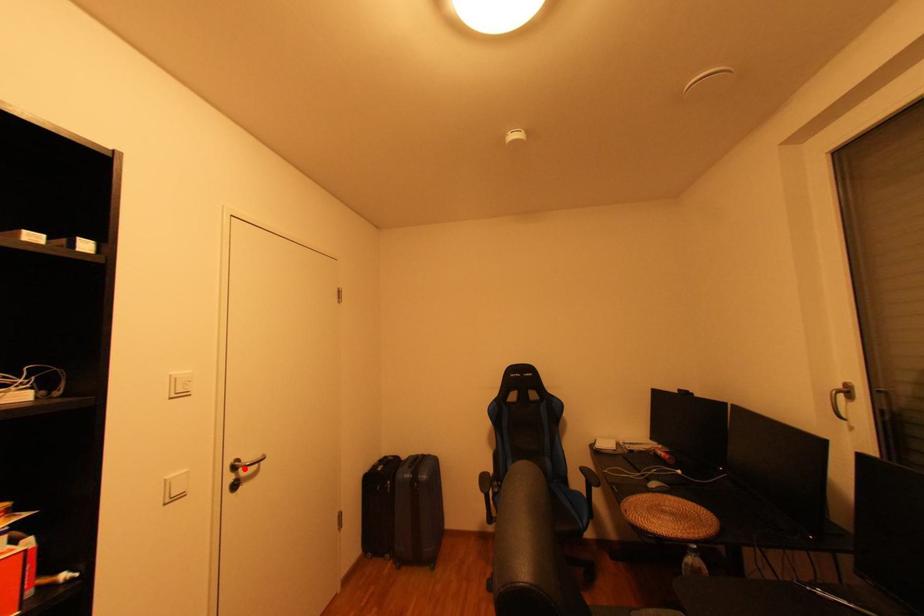
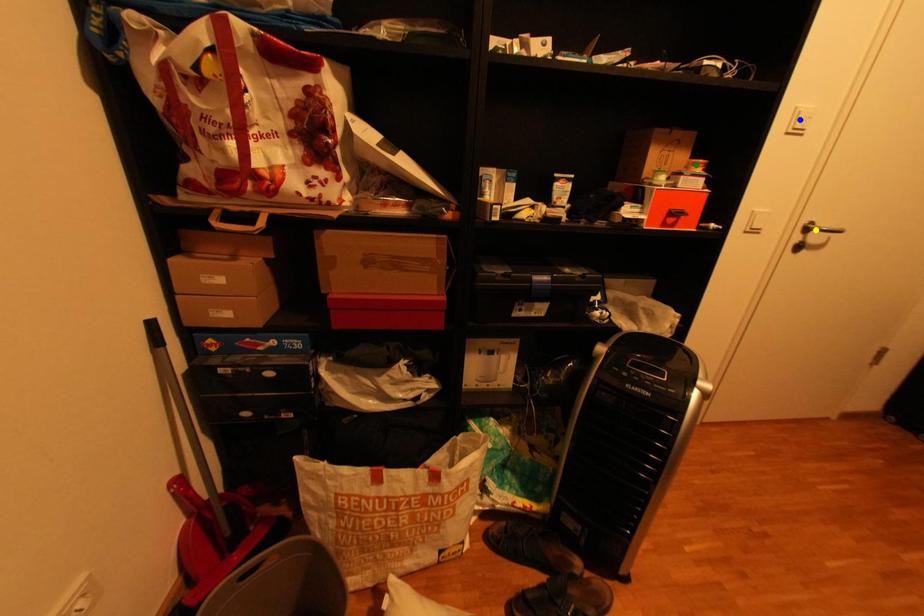
Question: I am providing you with two images of the same scene from different viewpoints. A red point is marked on the first image. You are given multiple points on the second image. Which point in image 2 represents the same 3d spot as the red point in image 1?

Choices:
 (A) green point
 (B) blue point
 (C) yellow point

Answer: (C)